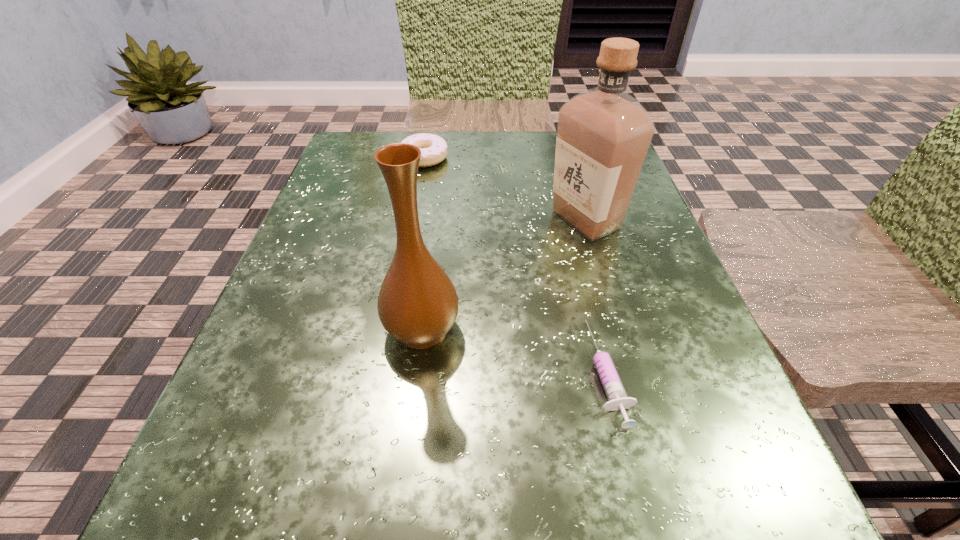
The width and height of the screenshot is (960, 540). What are the coordinates of `blank space located on the front of the farthest object` in the screenshot? It's located at (407, 249).

Find the location of a particular element. The image size is (960, 540). vacant area situated 0.400m on the left of the taller syringe is located at coordinates (285, 373).

The image size is (960, 540). What are the coordinates of `object positioned at the far edge` in the screenshot? It's located at (433, 148).

The height and width of the screenshot is (540, 960). Find the location of `object at the left edge`. object at the left edge is located at coordinates (433, 148).

Locate an element on the screen. liquor at the right edge is located at coordinates (603, 134).

This screenshot has height=540, width=960. I want to click on syringe that is at the right edge, so click(x=617, y=398).

Locate an element on the screen. object at the far left corner is located at coordinates (433, 148).

The width and height of the screenshot is (960, 540). I want to click on vacant area at the far edge of the desktop, so click(474, 140).

Find the location of a particular element. The height and width of the screenshot is (540, 960). vacant space at the left edge of the desktop is located at coordinates (225, 406).

In the image, there is a desktop. What are the coordinates of `vacant space at the right edge` in the screenshot? It's located at (662, 363).